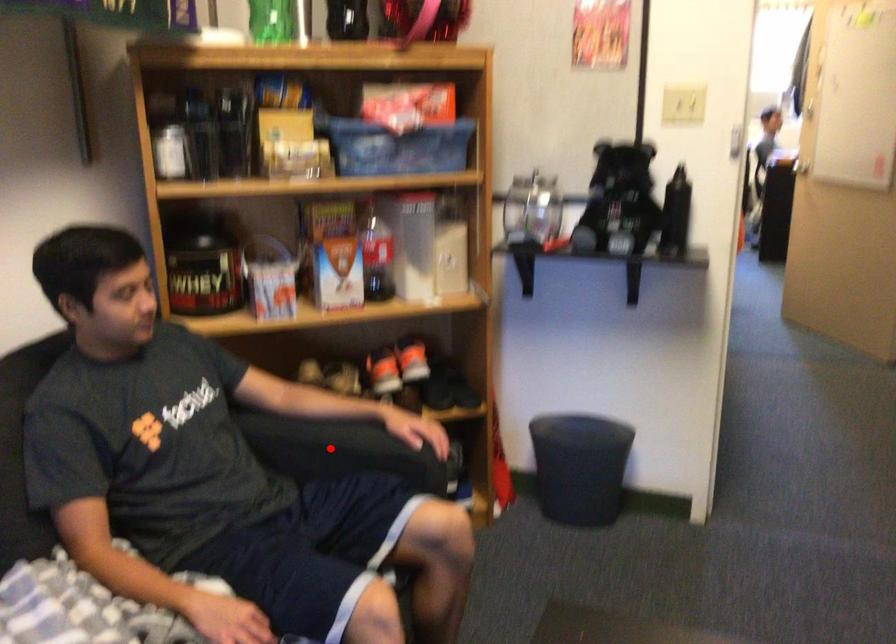
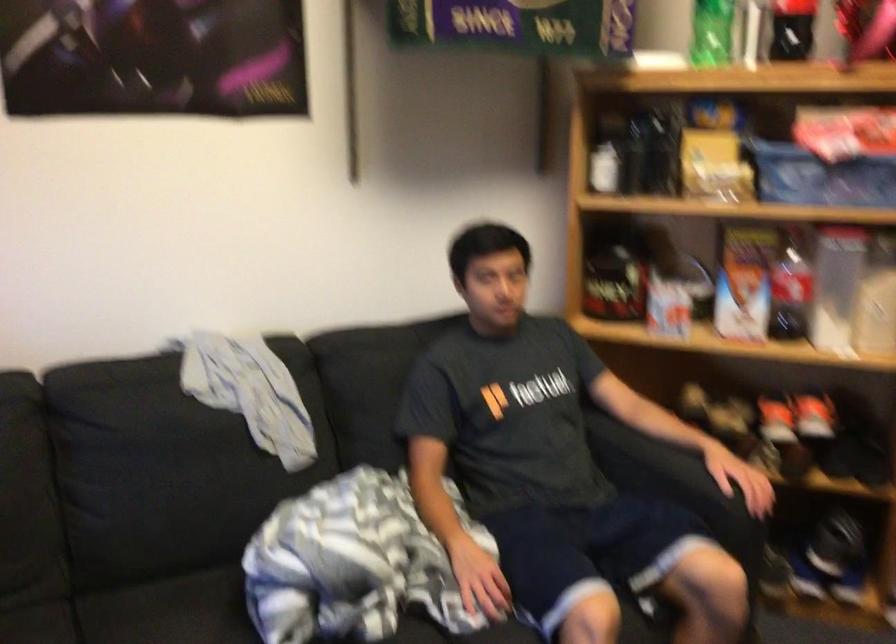
Where in the second image is the point corresponding to the highlighted location from the first image?

(650, 464)